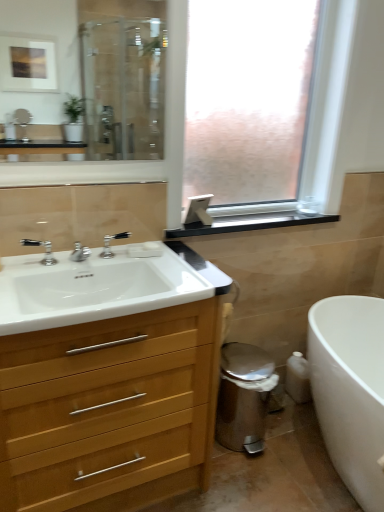
The image size is (384, 512). In order to click on vacant space in front of white matte soap at center in this screenshot , I will do `click(163, 266)`.